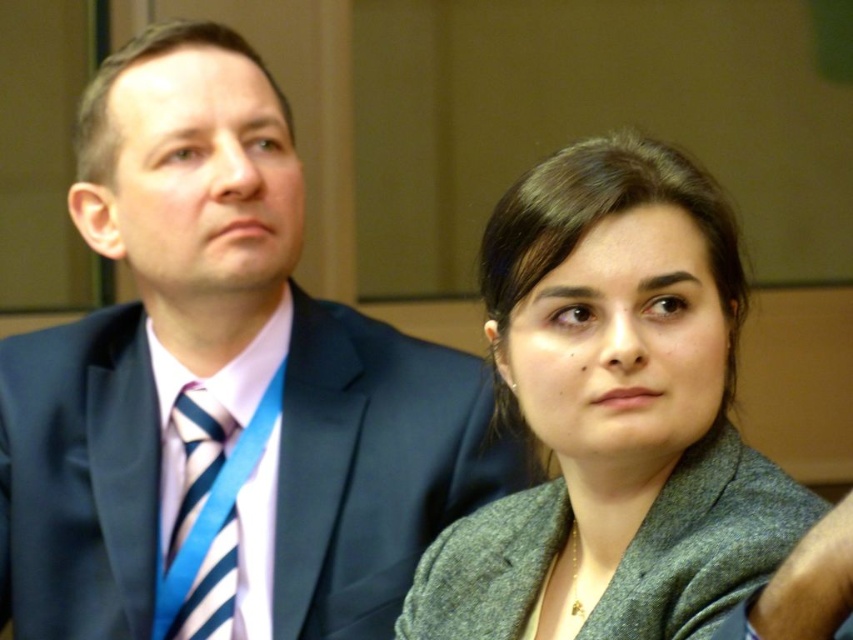
Question: Which point is farther to the camera?

Choices:
 (A) (218, 205)
 (B) (192, 529)
 (C) (686, 353)

Answer: (B)

Question: Estimate the real-world distances between objects in this image. Which object is closer to the dark blue suit at left?

Choices:
 (A) striped fabric tie at left
 (B) gray woolen jacket at center

Answer: (A)

Question: Among these objects, which one is farthest from the camera?

Choices:
 (A) gray woolen jacket at center
 (B) striped fabric tie at left

Answer: (B)

Question: Does dark blue suit at left appear on the left side of striped fabric tie at left?

Choices:
 (A) no
 (B) yes

Answer: (A)

Question: Is gray woolen jacket at center further to the viewer compared to striped fabric tie at left?

Choices:
 (A) yes
 (B) no

Answer: (B)

Question: Can you confirm if dark blue suit at left is thinner than striped fabric tie at left?

Choices:
 (A) yes
 (B) no

Answer: (B)